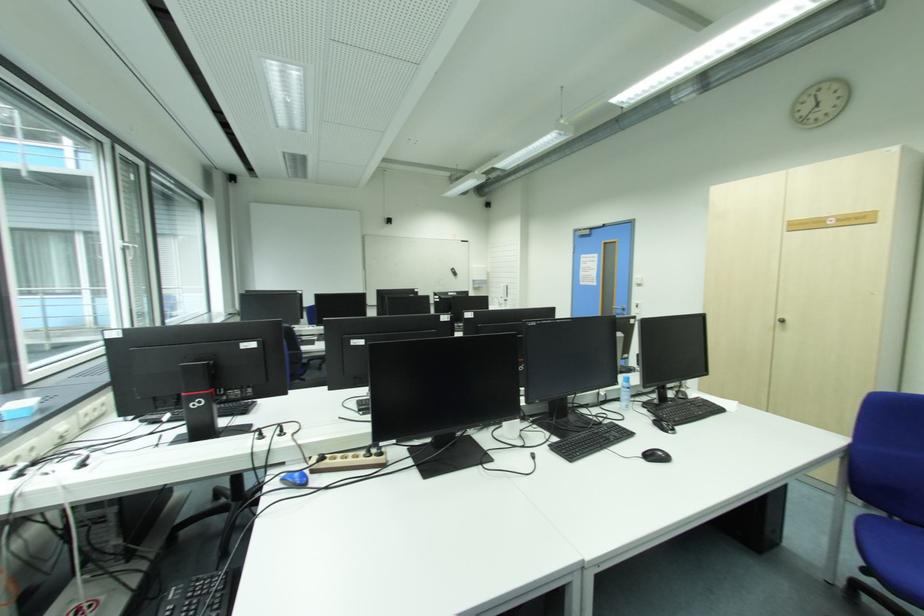
Find the location of a particular element. This screenshot has width=924, height=616. clear water bottle is located at coordinates (625, 392).